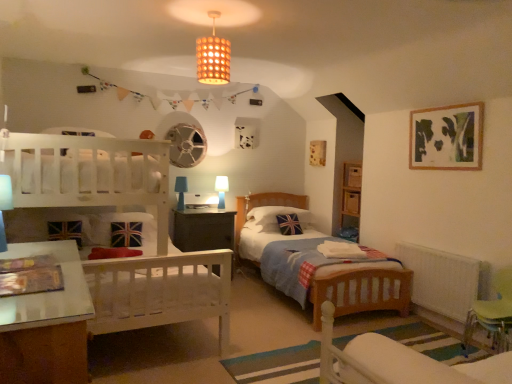
This screenshot has width=512, height=384. What do you see at coordinates (398, 362) in the screenshot?
I see `green plastic swivel chair at lower right, which appears as the first swivel chair when viewed from the front` at bounding box center [398, 362].

This screenshot has width=512, height=384. What do you see at coordinates (202, 229) in the screenshot?
I see `dark wood nightstand at center` at bounding box center [202, 229].

What do you see at coordinates (181, 191) in the screenshot? I see `blue fabric table lamp at center, placed as the second table lamp when sorted from back to front` at bounding box center [181, 191].

Locate an element on the screen. The image size is (512, 384). wooden drawer at center-right is located at coordinates (351, 203).

Which is closer, [183,240] or [474,150]?

Positioned in front is point [474,150].

From the image's perspective, is dark wood nightstand at center located above or below wooden picture frame at upper right?

dark wood nightstand at center is below wooden picture frame at upper right.

Is dark wood nightstand at center in front of wooden picture frame at upper right?

No, it is not.

Who is smaller, dark wood nightstand at center or wooden picture frame at upper right?

wooden picture frame at upper right is smaller.

Is wooden picture frame at upper right positioned with its back to white plastic table lamp at center, which is the 1th table lamp from back to front?

wooden picture frame at upper right does not have its back to white plastic table lamp at center, which is the 1th table lamp from back to front.

Is wooden picture frame at upper right to the left of white plastic table lamp at center, which appears as the 2th table lamp when viewed from the left, from the viewer's perspective?

Incorrect, wooden picture frame at upper right is not on the left side of white plastic table lamp at center, which appears as the 2th table lamp when viewed from the left.

Can you confirm if wooden picture frame at upper right is taller than white plastic table lamp at center, which is the 1th table lamp from back to front?

Yes, wooden picture frame at upper right is taller than white plastic table lamp at center, which is the 1th table lamp from back to front.

Would you say green plastic swivel chair at lower right, the 2th swivel chair when ordered from front to back, is inside or outside blue fabric table lamp at center, placed as the second table lamp when sorted from back to front?

green plastic swivel chair at lower right, the 2th swivel chair when ordered from front to back, is not enclosed by blue fabric table lamp at center, placed as the second table lamp when sorted from back to front.

From a real-world perspective, which table lamp is the 2nd one above the green plastic swivel chair at lower right, the 2th swivel chair when ordered from front to back? Please provide its 2D coordinates.

[(181, 191)]

Is green plastic swivel chair at lower right, the 2th swivel chair when ordered from front to back, facing away from blue fabric table lamp at center, marked as the 1th table lamp in a left-to-right arrangement?

green plastic swivel chair at lower right, the 2th swivel chair when ordered from front to back, does not have its back to blue fabric table lamp at center, marked as the 1th table lamp in a left-to-right arrangement.

How many degrees apart are the facing directions of green plastic swivel chair at lower right, the 2th swivel chair when ordered from front to back, and blue fabric table lamp at center, marked as the 1th table lamp in a left-to-right arrangement?

The facing directions of green plastic swivel chair at lower right, the 2th swivel chair when ordered from front to back, and blue fabric table lamp at center, marked as the 1th table lamp in a left-to-right arrangement, are 91.5 degrees apart.

Which of these two, wooden drawer at center-right or dark wood nightstand at center, is bigger?

dark wood nightstand at center is bigger.

Is wooden drawer at center-right thinner than dark wood nightstand at center?

Yes.

Choose the correct answer: Is wooden drawer at center-right inside dark wood nightstand at center or outside it?

wooden drawer at center-right is not enclosed by dark wood nightstand at center.

In the scene shown: Is wooden drawer at center-right not close to dark wood nightstand at center?

Yes, wooden drawer at center-right and dark wood nightstand at center are quite far apart.

In the scene shown: From a real-world perspective, does green plastic swivel chair at lower right, which appears as the 2th swivel chair when viewed from the back, stand above white plastic radiator at lower right?

Correct, in the physical world, green plastic swivel chair at lower right, which appears as the 2th swivel chair when viewed from the back, is higher than white plastic radiator at lower right.

Can you confirm if green plastic swivel chair at lower right, which appears as the 2th swivel chair when viewed from the back, is smaller than white plastic radiator at lower right?

Correct, green plastic swivel chair at lower right, which appears as the 2th swivel chair when viewed from the back, occupies less space than white plastic radiator at lower right.

Where is `swivel chair that appears on the left of white plastic radiator at lower right`? The width and height of the screenshot is (512, 384). swivel chair that appears on the left of white plastic radiator at lower right is located at coordinates (398, 362).

Is green plastic swivel chair at lower right, which appears as the 2th swivel chair when viewed from the right, positioned far away from white plastic radiator at lower right?

Yes, green plastic swivel chair at lower right, which appears as the 2th swivel chair when viewed from the right, and white plastic radiator at lower right are quite far apart.

Is dark wood nightstand at center looking in the opposite direction of white plastic table lamp at center, which appears as the 2th table lamp when viewed from the left?

No, white plastic table lamp at center, which appears as the 2th table lamp when viewed from the left, is not at the back of dark wood nightstand at center.

Looking at this image, from the image's perspective, does dark wood nightstand at center appear higher than white plastic table lamp at center, which is the 1th table lamp from back to front?

No.

Is dark wood nightstand at center at the left side of white plastic table lamp at center, the 1th table lamp viewed from the right?

Yes, dark wood nightstand at center is to the left of white plastic table lamp at center, the 1th table lamp viewed from the right.

Which object is further away from the camera, dark wood nightstand at center or white plastic table lamp at center, the 1th table lamp viewed from the right?

white plastic table lamp at center, the 1th table lamp viewed from the right, is behind.

From the image's perspective, between blue fabric table lamp at center, marked as the 1th table lamp in a left-to-right arrangement, and dark wood nightstand at center, who is located below?

From the image's view, dark wood nightstand at center is below.

Does blue fabric table lamp at center, placed as the second table lamp when sorted from back to front, turn towards dark wood nightstand at center?

No, blue fabric table lamp at center, placed as the second table lamp when sorted from back to front, is not turned towards dark wood nightstand at center.

Is blue fabric table lamp at center, the second table lamp in the right-to-left sequence, wider or thinner than dark wood nightstand at center?

blue fabric table lamp at center, the second table lamp in the right-to-left sequence, is thinner than dark wood nightstand at center.

Considering the sizes of blue fabric table lamp at center, marked as the 1th table lamp in a left-to-right arrangement, and dark wood nightstand at center in the image, is blue fabric table lamp at center, marked as the 1th table lamp in a left-to-right arrangement, taller or shorter than dark wood nightstand at center?

Clearly, blue fabric table lamp at center, marked as the 1th table lamp in a left-to-right arrangement, is shorter compared to dark wood nightstand at center.

I want to click on picture frame located in front of the dark wood nightstand at center, so click(447, 137).

Where is `picture frame on the right of white plastic table lamp at center, the 1th table lamp viewed from the right`? This screenshot has width=512, height=384. picture frame on the right of white plastic table lamp at center, the 1th table lamp viewed from the right is located at coordinates (447, 137).

From the image, which object appears to be nearer to green plastic swivel chair at lower right, the 2th swivel chair when ordered from front to back, blue fabric table lamp at center, placed as the second table lamp when sorted from back to front, or green plastic swivel chair at lower right, which appears as the 2th swivel chair when viewed from the right?

Based on the image, green plastic swivel chair at lower right, which appears as the 2th swivel chair when viewed from the right, appears to be nearer to green plastic swivel chair at lower right, the 2th swivel chair when ordered from front to back.

Estimate the real-world distances between objects in this image. Which object is further from wooden drawer at center-right, white plastic radiator at lower right or green plastic swivel chair at lower right, the first swivel chair from the right?

Based on the image, green plastic swivel chair at lower right, the first swivel chair from the right, appears to be further to wooden drawer at center-right.

Estimate the real-world distances between objects in this image. Which object is closer to wooden drawer at center-right, blue fabric pillow at center or dark wood nightstand at center?

The object closer to wooden drawer at center-right is blue fabric pillow at center.

Based on their spatial positions, is blue fabric pillow at center or green plastic swivel chair at lower right, which appears as the 2th swivel chair when viewed from the back, further from matte brown lampshade at upper center?

green plastic swivel chair at lower right, which appears as the 2th swivel chair when viewed from the back, is further to matte brown lampshade at upper center.

Estimate the real-world distances between objects in this image. Which object is further from white wooden bunk bed at left, white plastic radiator at lower right or wooden drawer at center-right?

wooden drawer at center-right is positioned further to the anchor white wooden bunk bed at left.

When comparing their distances from white wooden bunk bed at left, does green plastic swivel chair at lower right, which appears as the 2th swivel chair when viewed from the right, or blue fabric table lamp at center, marked as the 1th table lamp in a left-to-right arrangement, seem closer?

Among the two, green plastic swivel chair at lower right, which appears as the 2th swivel chair when viewed from the right, is located nearer to white wooden bunk bed at left.

Looking at the image, which one is located closer to blue fabric table lamp at center, placed as the second table lamp when sorted from back to front, wooden drawer at center-right or dark wood nightstand at center?

dark wood nightstand at center is positioned closer to the anchor blue fabric table lamp at center, placed as the second table lamp when sorted from back to front.

Estimate the real-world distances between objects in this image. Which object is further from blue fabric pillow at center, wooden picture frame at upper right or white plastic radiator at lower right?

wooden picture frame at upper right lies further to blue fabric pillow at center than the other object.

This screenshot has height=384, width=512. I want to click on radiator between white wooden bunk bed at left and wooden picture frame at upper right from left to right, so click(441, 279).

At what (x,y) coordinates should I click in order to perform the action: click on radiator located between wooden lampshade at upper center and white plastic table lamp at center, which appears as the 2th table lamp when viewed from the left, in the depth direction. Please return your answer as a coordinate pair (x, y). The width and height of the screenshot is (512, 384). Looking at the image, I should click on (441, 279).

Where is `pillow between white plastic table lamp at center, the 1th table lamp viewed from the right, and wooden picture frame at upper right from left to right`? pillow between white plastic table lamp at center, the 1th table lamp viewed from the right, and wooden picture frame at upper right from left to right is located at coordinates (274, 218).

At what (x,y) coordinates should I click in order to perform the action: click on table lamp situated between dark wood nightstand at center and wooden drawer at center-right from left to right. Please return your answer as a coordinate pair (x, y). The height and width of the screenshot is (384, 512). Looking at the image, I should click on (221, 190).